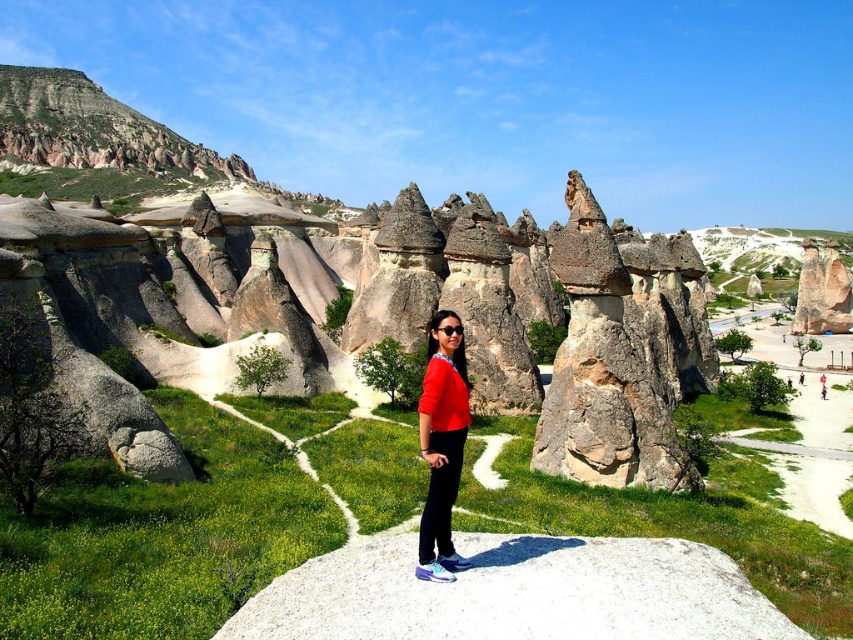
Can you confirm if rustic stone rock formation at center is bigger than red matte sweater at center?

Yes, rustic stone rock formation at center is bigger than red matte sweater at center.

Who is higher up, rustic stone rock formation at center or red matte sweater at center?

rustic stone rock formation at center

Which is in front, point (341, 346) or point (427, 364)?

Positioned in front is point (427, 364).

At what (x,y) coordinates should I click in order to perform the action: click on rustic stone rock formation at center. Please return your answer as a coordinate pair (x, y). This screenshot has width=853, height=640. Looking at the image, I should click on (401, 316).